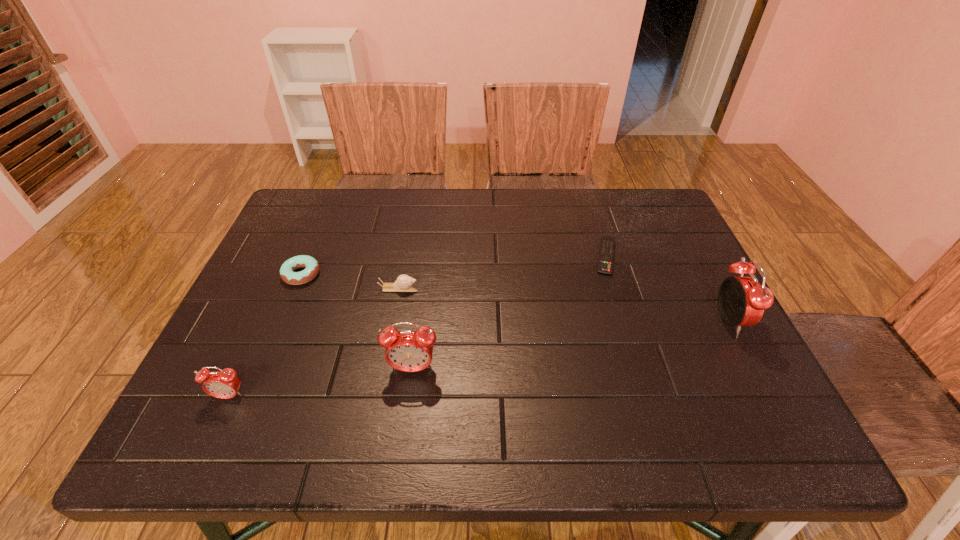
You are a GUI agent. You are given a task and a screenshot of the screen. Output one action in this format:
    pyautogui.click(x=<x>, y=<y>)
    Task: Click on the leftmost alarm clock
    
    Given the screenshot: What is the action you would take?
    pyautogui.click(x=224, y=384)

I want to click on the nearest object, so click(224, 384).

What are the coordinates of `the second tallest object` in the screenshot? It's located at (409, 351).

Where is `the second nearest object`? The image size is (960, 540). the second nearest object is located at coordinates (409, 351).

Identify the location of the rightmost object. This screenshot has height=540, width=960. (742, 300).

The image size is (960, 540). Find the location of `the rightmost alarm clock`. the rightmost alarm clock is located at coordinates (742, 300).

Image resolution: width=960 pixels, height=540 pixels. Identify the location of the second object from right to left. coord(605,265).

Find the location of a particular element. remote control is located at coordinates (605, 265).

Image resolution: width=960 pixels, height=540 pixels. Find the location of `doughnut`. doughnut is located at coordinates (287, 274).

This screenshot has height=540, width=960. Identify the location of escargot. (403, 283).